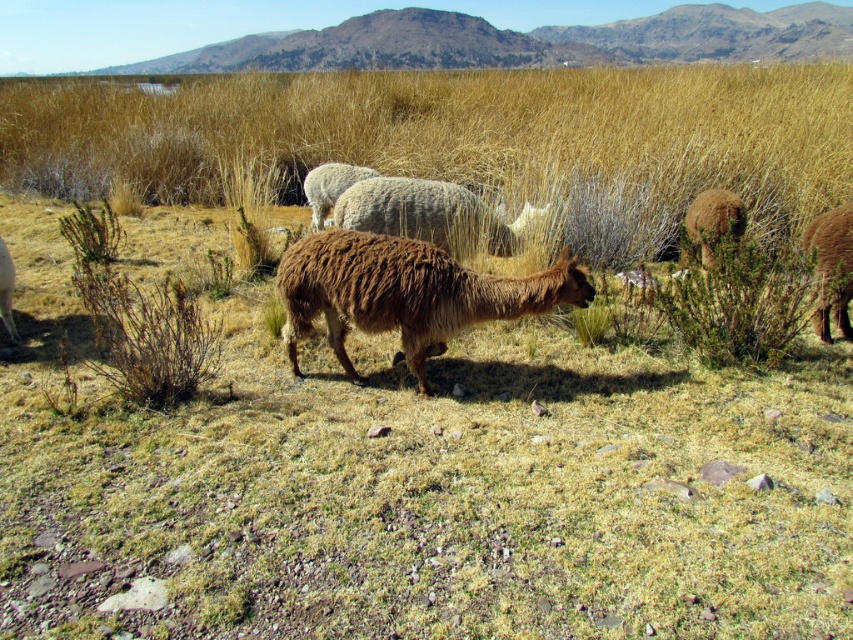
Does fuzzy white sheep at center have a greater width compared to brown woolly sheep at right?

Yes, fuzzy white sheep at center is wider than brown woolly sheep at right.

Based on the photo, who is more forward, (444, 193) or (820, 273)?

Point (820, 273) is more forward.

Find the location of a particular element. The height and width of the screenshot is (640, 853). fuzzy white sheep at center is located at coordinates (431, 214).

Can you confirm if brown woolly alpaca at center-right is thinner than white woolly sheep at center?

Indeed, brown woolly alpaca at center-right has a lesser width compared to white woolly sheep at center.

Is brown woolly alpaca at center-right above white woolly sheep at center?

No.

Who is more forward, (689, 218) or (323, 209)?

Point (689, 218)

You are a GUI agent. You are given a task and a screenshot of the screen. Output one action in this format:
    pyautogui.click(x=<x>, y=<y>)
    Task: Click on the brown woolly alpaca at center-right
    The height and width of the screenshot is (640, 853).
    Given the screenshot: What is the action you would take?
    pyautogui.click(x=711, y=224)

Between brown woolly alpaca at center and fuzzy white sheep at center, which one appears on the right side from the viewer's perspective?

From the viewer's perspective, fuzzy white sheep at center appears more on the right side.

Between point (341, 266) and point (421, 218), which one is positioned in front?

Positioned in front is point (341, 266).

This screenshot has width=853, height=640. Identify the location of brown woolly alpaca at center. (405, 292).